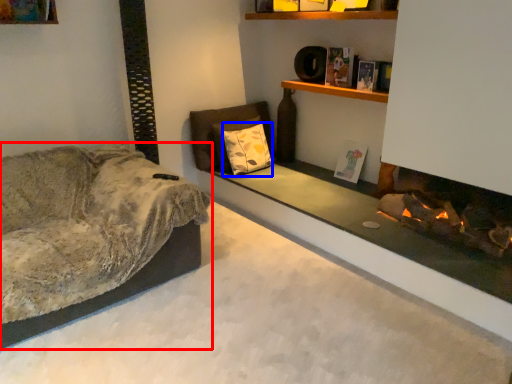
Question: Which object is closer to the camera taking this photo, studio couch (highlighted by a red box) or pillow (highlighted by a blue box)?

Choices:
 (A) studio couch
 (B) pillow

Answer: (A)